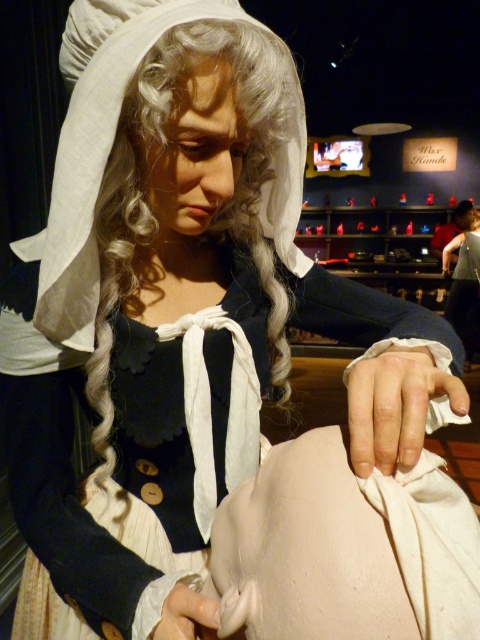
Does white silky hair at center appear over matte white wig at upper left?

No.

Does white silky hair at center appear on the left side of matte white wig at upper left?

Yes, white silky hair at center is to the left of matte white wig at upper left.

Consider the image. Measure the distance between white silky hair at center and camera.

A distance of 53.35 centimeters exists between white silky hair at center and camera.

Identify the location of white silky hair at center. The width and height of the screenshot is (480, 640). (217, 208).